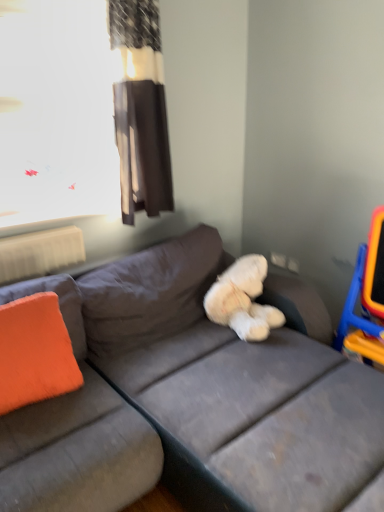
What do you see at coordinates (140, 108) in the screenshot? I see `brown fabric curtain at upper center` at bounding box center [140, 108].

Locate an element on the screen. transparent plastic window screen at upper left is located at coordinates (56, 112).

Describe the element at coordinates (35, 352) in the screenshot. I see `orange fabric pillow at left` at that location.

Measure the distance between point (48, 297) and camera.

Point (48, 297) and camera are 1.75 meters apart from each other.

This screenshot has width=384, height=512. What do you see at coordinates (228, 382) in the screenshot? I see `gray fabric couch at center` at bounding box center [228, 382].

Locate an element on the screen. This screenshot has width=384, height=512. white fluffy teddy bear at center is located at coordinates (243, 300).

What is the approximate width of white fluffy teddy bear at center?

It is 16.07 inches.

Identify the location of orange plastic swivel chair at right. (366, 300).

Looking at this image, between gray fabric couch at center and brown fabric curtain at upper center, which one appears on the right side from the viewer's perspective?

gray fabric couch at center is more to the right.

Choose the correct answer: Is gray fabric couch at center inside brown fabric curtain at upper center or outside it?

gray fabric couch at center is spatially situated outside brown fabric curtain at upper center.

The height and width of the screenshot is (512, 384). I want to click on studio couch in front of the brown fabric curtain at upper center, so click(x=228, y=382).

Is gray fabric couch at center beside brown fabric curtain at upper center?

gray fabric couch at center and brown fabric curtain at upper center are clearly separated.

The width and height of the screenshot is (384, 512). What are the coordinates of `throw pillow that is on the left side of white fluffy teddy bear at center` in the screenshot? It's located at (35, 352).

Is orange fabric pillow at left further to the viewer compared to white fluffy teddy bear at center?

No, it is not.

Can you see orange fabric pillow at left touching white fluffy teddy bear at center?

There is a gap between orange fabric pillow at left and white fluffy teddy bear at center.

Who is taller, orange fabric pillow at left or white fluffy teddy bear at center?

orange fabric pillow at left.

This screenshot has height=512, width=384. What are the coordinates of `throw pillow on the left of gray fabric couch at center` in the screenshot? It's located at (35, 352).

Who is shorter, orange fabric pillow at left or gray fabric couch at center?

With less height is orange fabric pillow at left.

Does orange fabric pillow at left come behind gray fabric couch at center?

Yes.

Between point (48, 335) and point (127, 263), which one is positioned in front?

Positioned in front is point (48, 335).

Which of these two, transparent plastic window screen at upper left or brown fabric curtain at upper center, is thinner?

transparent plastic window screen at upper left.

Would you say transparent plastic window screen at upper left is a long distance from brown fabric curtain at upper center?

They are positioned close to each other.

Locate an element on the screen. This screenshot has width=384, height=512. window screen lying in front of the brown fabric curtain at upper center is located at coordinates click(x=56, y=112).

Does point (80, 165) appear closer or farther from the camera than point (139, 0)?

Point (80, 165) is positioned farther from the camera compared to point (139, 0).

Which is farther from the camera, (148, 370) or (250, 314)?

Point (250, 314)

Could you tell me if gray fabric couch at center is turned towards white fluffy teddy bear at center?

No, gray fabric couch at center is not facing towards white fluffy teddy bear at center.

How different are the orientations of gray fabric couch at center and white fluffy teddy bear at center in degrees?

88.3 degrees.

Is gray fabric couch at center taller than white fluffy teddy bear at center?

Yes, gray fabric couch at center is taller than white fluffy teddy bear at center.

The width and height of the screenshot is (384, 512). What are the coordinates of `teddy lying on the right of brown fabric curtain at upper center` in the screenshot? It's located at [243, 300].

Which object is wider, white fluffy teddy bear at center or brown fabric curtain at upper center?

white fluffy teddy bear at center is wider.

From a real-world perspective, is white fluffy teddy bear at center positioned under brown fabric curtain at upper center based on gravity?

Yes, from a real-world perspective, white fluffy teddy bear at center is beneath brown fabric curtain at upper center.

From the image's perspective, relative to brown fabric curtain at upper center, is white fluffy teddy bear at center above or below?

white fluffy teddy bear at center is below brown fabric curtain at upper center.

Considering the points (100, 0) and (366, 355), which point is in front, point (100, 0) or point (366, 355)?

Positioned in front is point (366, 355).

Is transparent plastic window screen at upper left not close to orange plastic swivel chair at right?

Absolutely, transparent plastic window screen at upper left is distant from orange plastic swivel chair at right.

How different are the orientations of transparent plastic window screen at upper left and orange plastic swivel chair at right in degrees?

88 degrees separate the facing orientations of transparent plastic window screen at upper left and orange plastic swivel chair at right.

From a real-world perspective, is transparent plastic window screen at upper left on top of orange plastic swivel chair at right?

Yes, from a real-world perspective, transparent plastic window screen at upper left is on top of orange plastic swivel chair at right.

I want to click on studio couch that appears in front of the brown fabric curtain at upper center, so click(x=228, y=382).

Locate an element on the screen. throw pillow on the left of white fluffy teddy bear at center is located at coordinates (35, 352).

Looking at the image, which one is located closer to white fluffy teddy bear at center, transparent plastic window screen at upper left or gray fabric couch at center?

gray fabric couch at center lies closer to white fluffy teddy bear at center than the other object.

Considering their positions, is gray fabric couch at center positioned closer to brown fabric curtain at upper center than orange fabric pillow at left?

gray fabric couch at center.

Estimate the real-world distances between objects in this image. Which object is further from transparent plastic window screen at upper left, gray fabric couch at center or orange fabric pillow at left?

gray fabric couch at center is further to transparent plastic window screen at upper left.

Considering their positions, is transparent plastic window screen at upper left positioned closer to orange fabric pillow at left than white fluffy teddy bear at center?

white fluffy teddy bear at center lies closer to orange fabric pillow at left than the other object.

Looking at this image, estimate the real-world distances between objects in this image. Which object is further from orange plastic swivel chair at right, brown fabric curtain at upper center or white fluffy teddy bear at center?

Based on the image, brown fabric curtain at upper center appears to be further to orange plastic swivel chair at right.

Based on their spatial positions, is transparent plastic window screen at upper left or orange fabric pillow at left further from brown fabric curtain at upper center?

Based on the image, orange fabric pillow at left appears to be further to brown fabric curtain at upper center.

From the image, which object appears to be nearer to orange fabric pillow at left, brown fabric curtain at upper center or orange plastic swivel chair at right?

brown fabric curtain at upper center is positioned closer to the anchor orange fabric pillow at left.

Considering their positions, is white fluffy teddy bear at center positioned further to orange fabric pillow at left than gray fabric couch at center?

white fluffy teddy bear at center is positioned further to the anchor orange fabric pillow at left.

I want to click on teddy between brown fabric curtain at upper center and orange fabric pillow at left in the vertical direction, so click(243, 300).

The height and width of the screenshot is (512, 384). I want to click on swivel chair between gray fabric couch at center and white fluffy teddy bear at center in the front-back direction, so click(366, 300).

This screenshot has height=512, width=384. I want to click on teddy between brown fabric curtain at upper center and orange plastic swivel chair at right from left to right, so [x=243, y=300].

At what (x,y) coordinates should I click in order to perform the action: click on teddy between orange fabric pillow at left and orange plastic swivel chair at right from left to right. Please return your answer as a coordinate pair (x, y). Looking at the image, I should click on (243, 300).